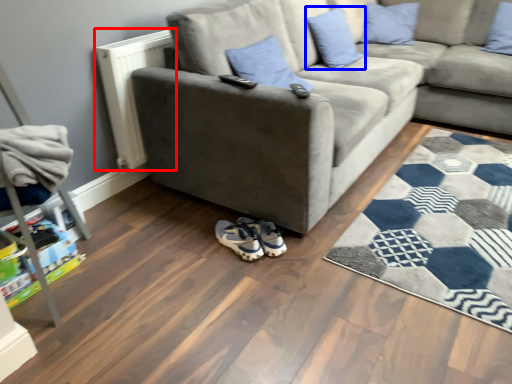
Question: Which object is closer to the camera taking this photo, radiator (highlighted by a red box) or pillow (highlighted by a blue box)?

Choices:
 (A) radiator
 (B) pillow

Answer: (A)